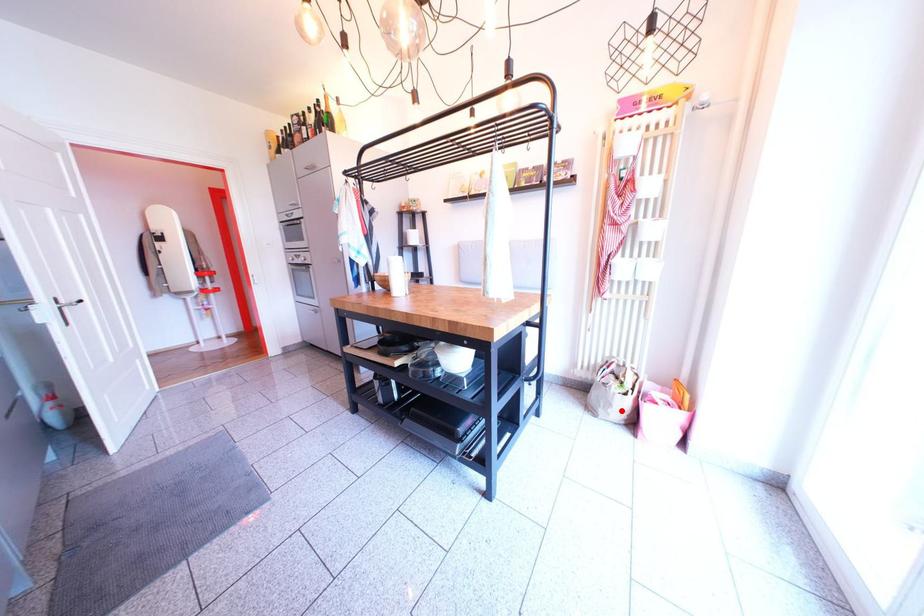
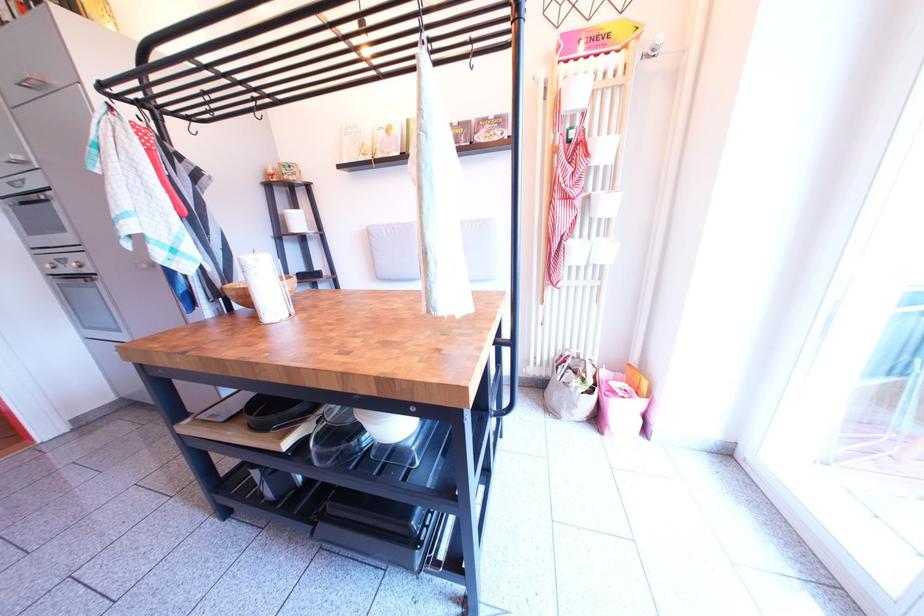
Question: I am providing you with two images of the same scene from different viewpoints. Given a red point in image1, look at the same physical point in image2. Is it:

Choices:
 (A) Closer to the viewpoint
 (B) Farther from the viewpoint

Answer: (B)